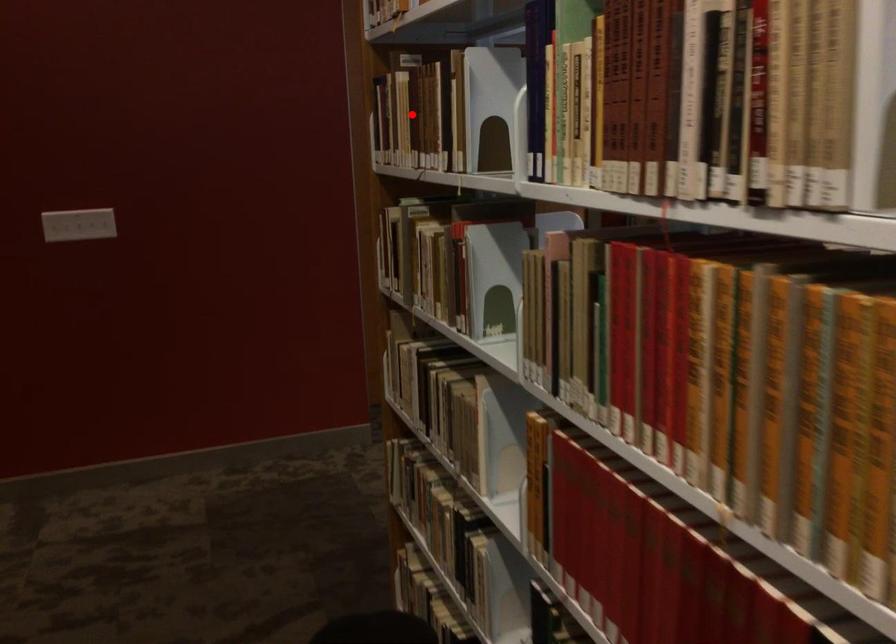
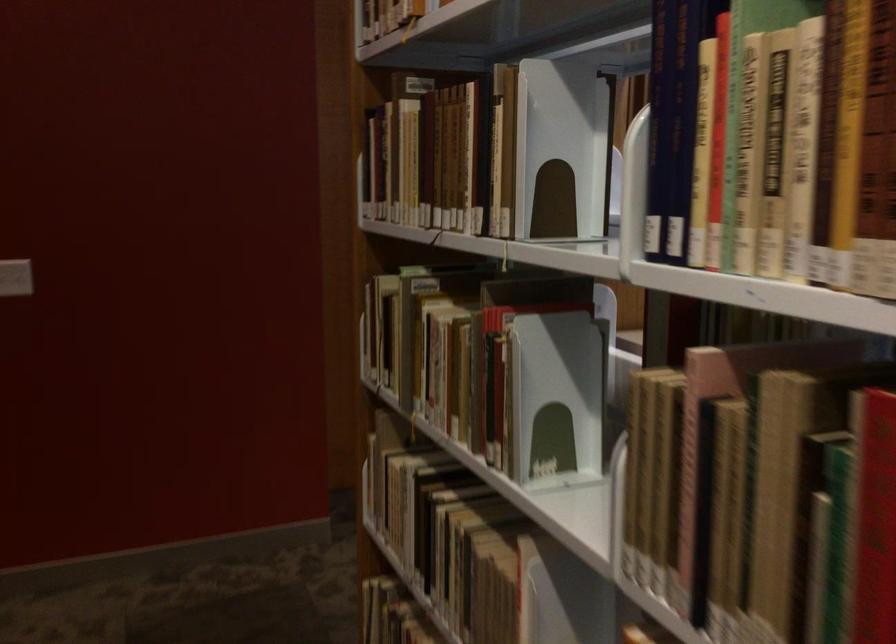
Question: I am providing you with two images of the same scene from different viewpoints. Given a red point in image1, look at the same physical point in image2. Is it:

Choices:
 (A) Closer to the viewpoint
 (B) Farther from the viewpoint

Answer: (A)